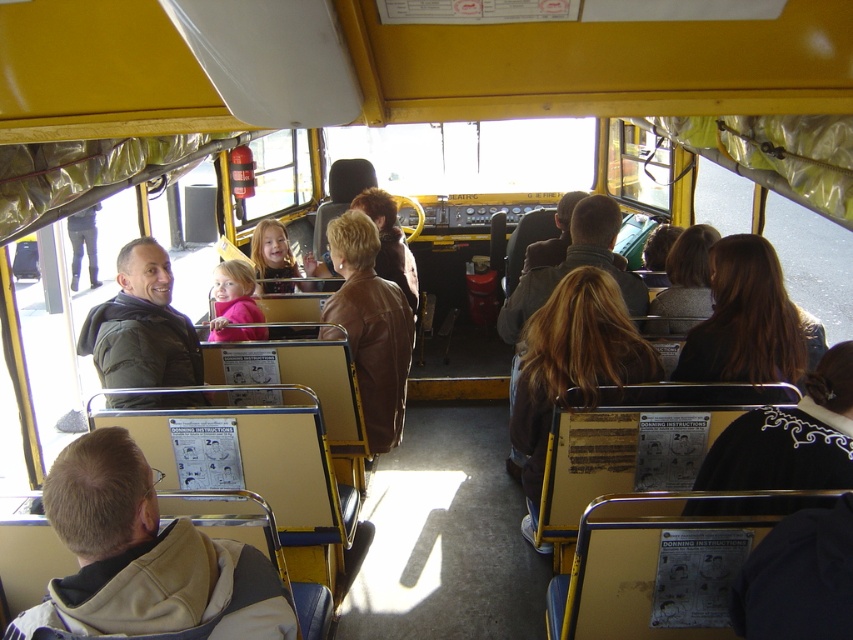
Based on the photo, you are a passenger on this bus and want to know what is located at the coordinate point (144, 560). What object is at that location?

The beige fabric jacket at lower left is located at the coordinate point (144, 560).

You are a passenger on the bus and want to borrow a jacket from either the beige fabric jacket at lower left or the black leather jacket at lower right. Which jacket is easier to reach without moving from your current seat?

The beige fabric jacket at lower left is closer to the viewer than the black leather jacket at lower right, so it is easier to reach without moving from your current seat.

You are standing at the camera position and want to reach the point marked at coordinates (791, 358) in the bus interior. If you can walk 10 feet in 1 minute, how long will it take you to reach that point?

The point marked at coordinates (791, 358) is 9.31 feet away from your current position. Since you can walk 10 feet in 1 minute, it will take you approximately 0.93 minutes, or about 56 seconds, to reach that point.